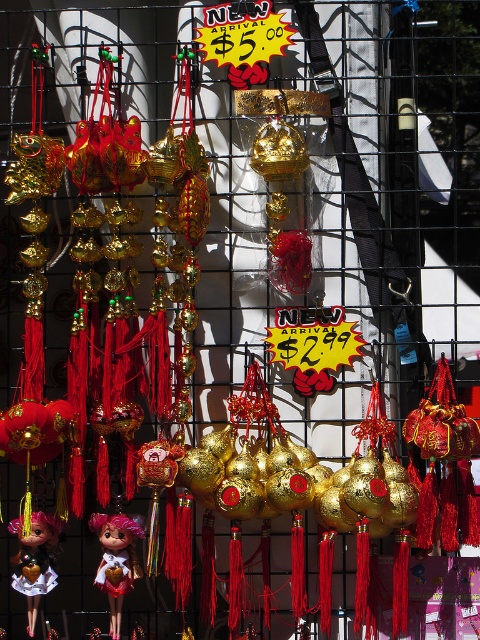
Can you confirm if matte pink doll at center is positioned above matte pink doll at lower left?

Actually, matte pink doll at center is below matte pink doll at lower left.

Between point (121, 602) and point (27, 545), which one is positioned in front?

Point (27, 545) is in front.

Image resolution: width=480 pixels, height=640 pixels. Find the location of `matte pink doll at center`. matte pink doll at center is located at coordinates (116, 561).